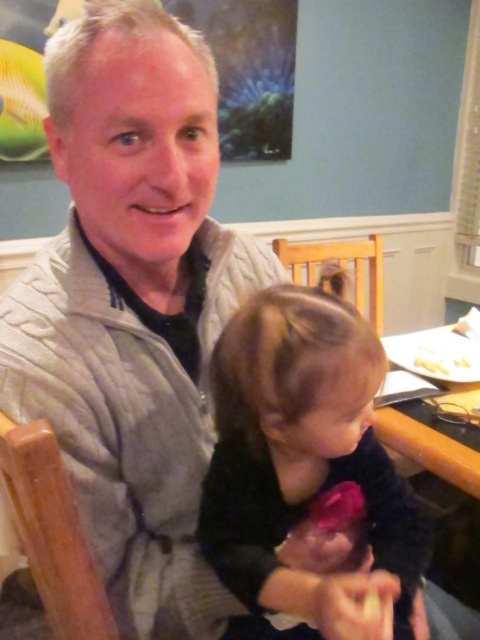
Which is more to the right, wooden table at center or white matte plate at upper right?

white matte plate at upper right

Is wooden table at center wider than white matte plate at upper right?

Indeed, wooden table at center has a greater width compared to white matte plate at upper right.

Who is more distant from viewer, [423,465] or [448,360]?

The point [448,360] is behind.

The width and height of the screenshot is (480, 640). I want to click on wooden table at center, so [431, 449].